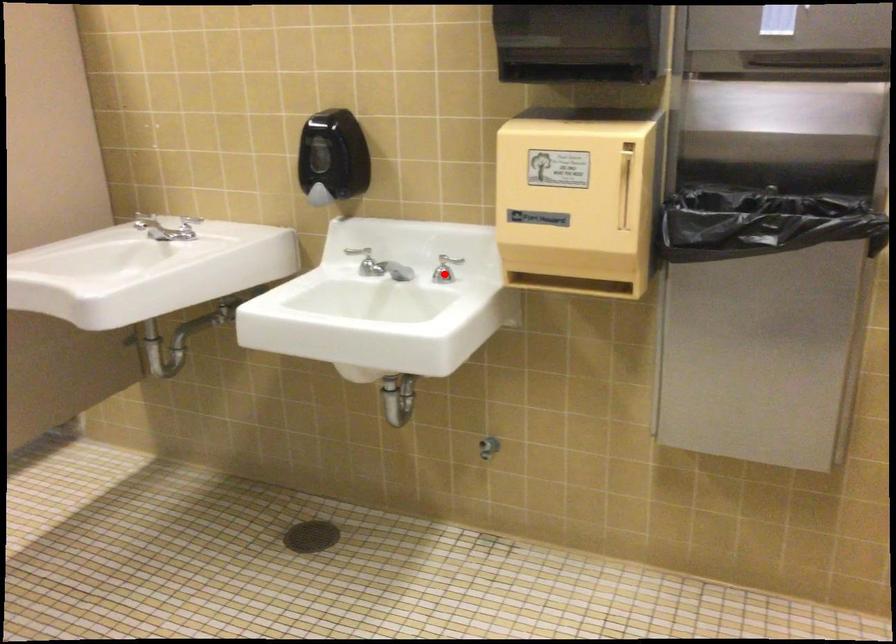
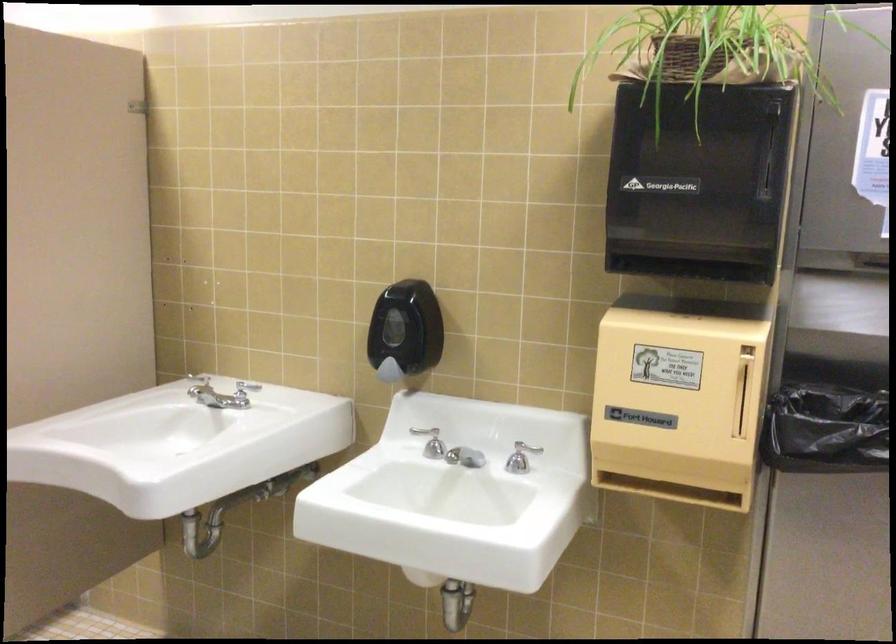
The point at the highlighted location is marked in the first image. Where is the corresponding point in the second image?

(521, 458)